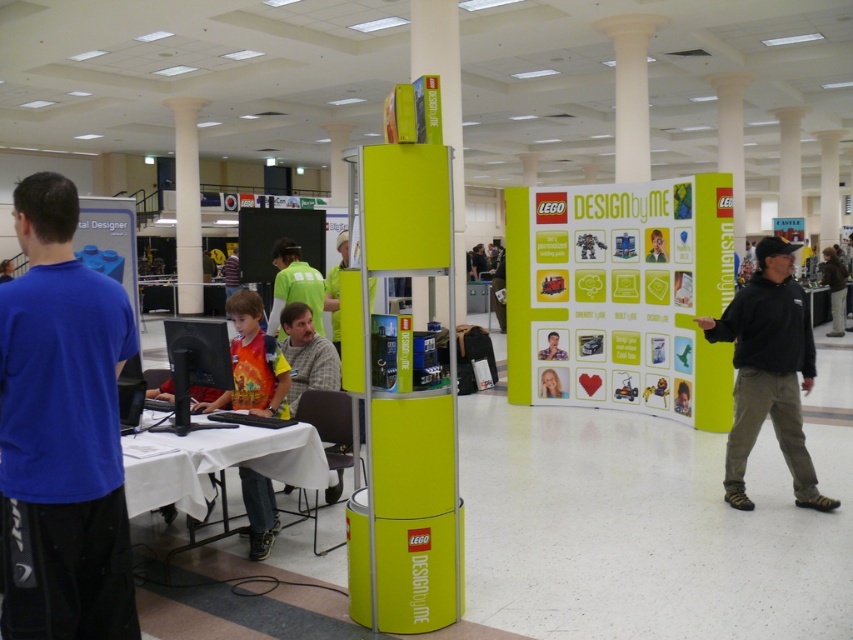
Is green shirt at center to the right of black matte jacket at center right from the viewer's perspective?

Incorrect, green shirt at center is not on the right side of black matte jacket at center right.

Who is more forward, (311, 268) or (837, 316)?

Point (311, 268) is in front.

This screenshot has width=853, height=640. What are the coordinates of `green shirt at center` in the screenshot? It's located at (294, 285).

Is orange t-shirt at center further to the viewer compared to yellow-green shirt at center?

No.

Is orange t-shirt at center thinner than yellow-green shirt at center?

Indeed, orange t-shirt at center has a lesser width compared to yellow-green shirt at center.

Does point (260, 355) come behind point (235, 259)?

That is False.

Where is `orange t-shirt at center`? The height and width of the screenshot is (640, 853). orange t-shirt at center is located at coordinates (252, 364).

Between black matte jacket at center right and smooth plastic face at center, which one is positioned lower?

smooth plastic face at center is lower down.

Measure the distance between black matte jacket at center right and camera.

They are 13.80 meters apart.

The width and height of the screenshot is (853, 640). I want to click on black matte jacket at center right, so click(834, 289).